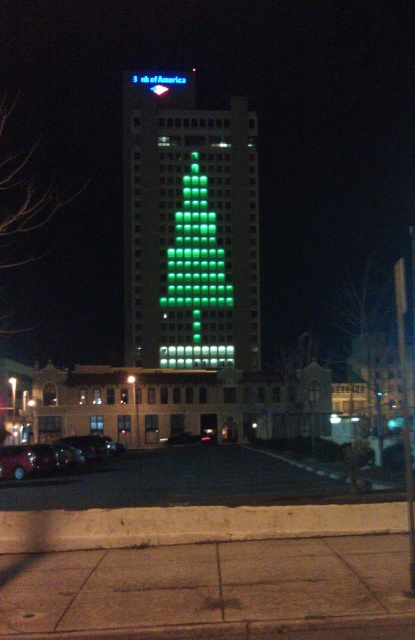
You are a delivery driver who needs to park your vehicle in the parking lot between the shiny red car at lower left and the shiny black sedan at lower left. Your truck is 2 meters wide. Can you fit your truck between them?

The shiny red car at lower left is wider than the shiny black sedan at lower left. Since the width between them depends on the space between the two cars, but the exact distance isn

You are a pedestrian standing at the entrance of the Bank of America building. You see a shiny black sedan at lower left and a green led sign at center. Which object is closer to your right side?

The green led sign at center is closer to your right side because the shiny black sedan at lower left is positioned to the left of it.